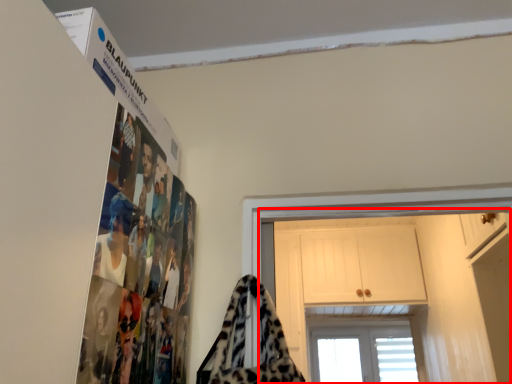
Question: In this image, where is dresser (annotated by the red box) located relative to blanket?

Choices:
 (A) right
 (B) left

Answer: (A)